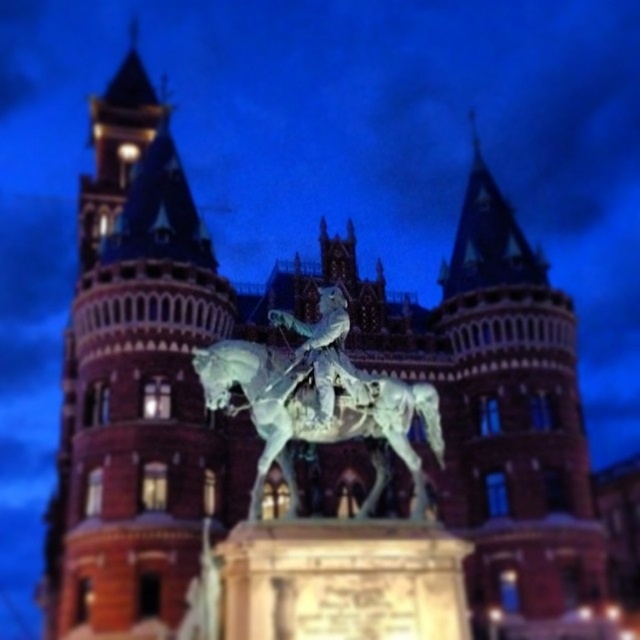
Question: Which point is farther from the camera taking this photo?

Choices:
 (A) (60, 627)
 (B) (330, 339)

Answer: (A)

Question: Is red brick tower at center to the right of polished bronze statue at center from the viewer's perspective?

Choices:
 (A) no
 (B) yes

Answer: (A)

Question: Is red brick tower at center smaller than polished bronze statue at center?

Choices:
 (A) yes
 (B) no

Answer: (B)

Question: Considering the relative positions of red brick tower at center and polished bronze statue at center in the image provided, where is red brick tower at center located with respect to polished bronze statue at center?

Choices:
 (A) left
 (B) right

Answer: (A)

Question: Which object appears closest to the camera in this image?

Choices:
 (A) polished bronze statue at center
 (B) red brick tower at center
 (C) polished bronze horse at center

Answer: (C)

Question: Which point is farther to the camera?

Choices:
 (A) polished bronze horse at center
 (B) red brick tower at center

Answer: (B)